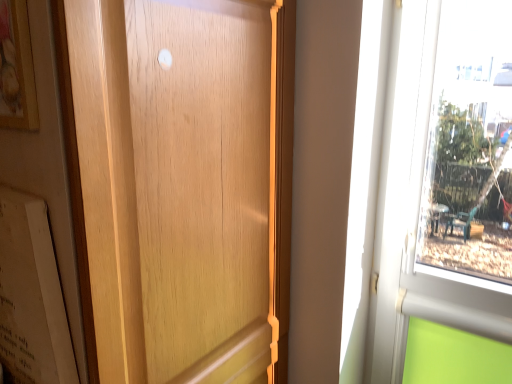
Question: Is point (27, 251) positioned closer to the camera than point (15, 92)?

Choices:
 (A) farther
 (B) closer

Answer: (A)

Question: From a real-world perspective, relative to wooden picture frame at upper left, is matte white paper at left vertically above or below?

Choices:
 (A) above
 (B) below

Answer: (B)

Question: Based on their relative distances, which object is nearer to the wooden picture frame at upper left?

Choices:
 (A) matte white paper at left
 (B) wooden door at center

Answer: (A)

Question: Estimate the real-world distances between objects in this image. Which object is closer to the matte white paper at left?

Choices:
 (A) wooden picture frame at upper left
 (B) wooden door at center

Answer: (B)